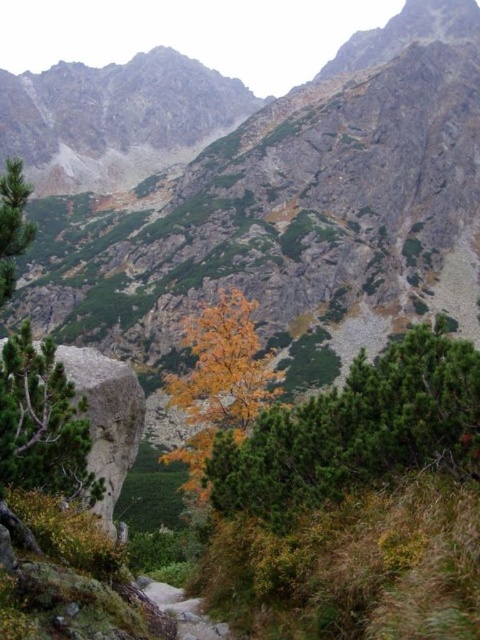
Question: Does green needle-like tree at center have a smaller size compared to golden leafy tree at center?

Choices:
 (A) no
 (B) yes

Answer: (A)

Question: Among these points, which one is farthest from the camera?

Choices:
 (A) (101, 496)
 (B) (190, 406)

Answer: (B)

Question: Estimate the real-world distances between objects in this image. Which object is closer to the green needle-like tree at center?

Choices:
 (A) green matte tree at center-left
 (B) golden leafy tree at center

Answer: (B)

Question: Which point is closer to the camera?

Choices:
 (A) green matte tree at center-left
 (B) golden leafy tree at center

Answer: (A)

Question: Can you confirm if green needle-like tree at center is positioned above golden leafy tree at center?

Choices:
 (A) yes
 (B) no

Answer: (A)

Question: From the image, what is the correct spatial relationship of green needle-like tree at center in relation to golden leafy tree at center?

Choices:
 (A) below
 (B) above

Answer: (B)